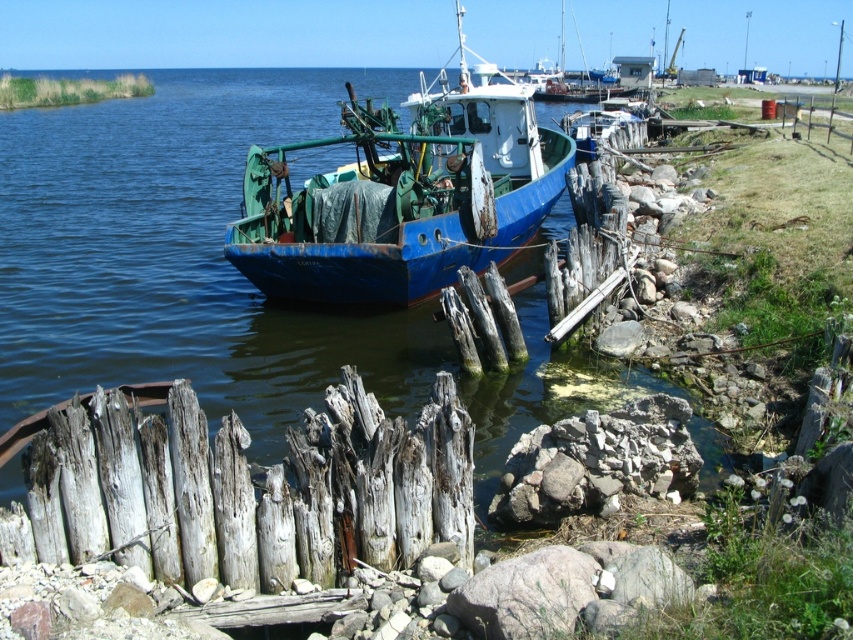
Question: Which object is closer to the camera taking this photo?

Choices:
 (A) weathered wood fence at lower left
 (B) blue matte boat at center

Answer: (A)

Question: Which point is closer to the camera?

Choices:
 (A) weathered wood fence at lower left
 (B) blue matte boat at center

Answer: (A)

Question: Is weathered wood fence at lower left wider than blue matte boat at center?

Choices:
 (A) no
 (B) yes

Answer: (A)

Question: Is weathered wood fence at lower left thinner than blue matte boat at center?

Choices:
 (A) no
 (B) yes

Answer: (B)

Question: Is weathered wood fence at lower left to the left of blue matte boat at center from the viewer's perspective?

Choices:
 (A) yes
 (B) no

Answer: (A)